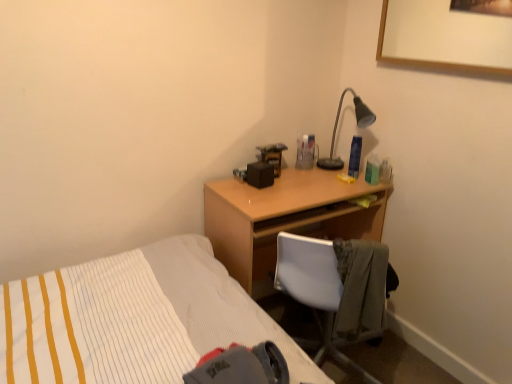
Question: From a real-world perspective, relative to white plastic chair at center, is light brown wood desk at center vertically above or below?

Choices:
 (A) below
 (B) above

Answer: (B)

Question: Is light brown wood desk at center inside the boundaries of white plastic chair at center, or outside?

Choices:
 (A) outside
 (B) inside

Answer: (B)

Question: Estimate the real-world distances between objects in this image. Which object is closer to the light brown wood desk at center?

Choices:
 (A) matte black desk lamp at upper right
 (B) white plastic chair at center

Answer: (B)

Question: Which is nearer to the matte black desk lamp at upper right?

Choices:
 (A) white plastic chair at center
 (B) light brown wood desk at center

Answer: (B)